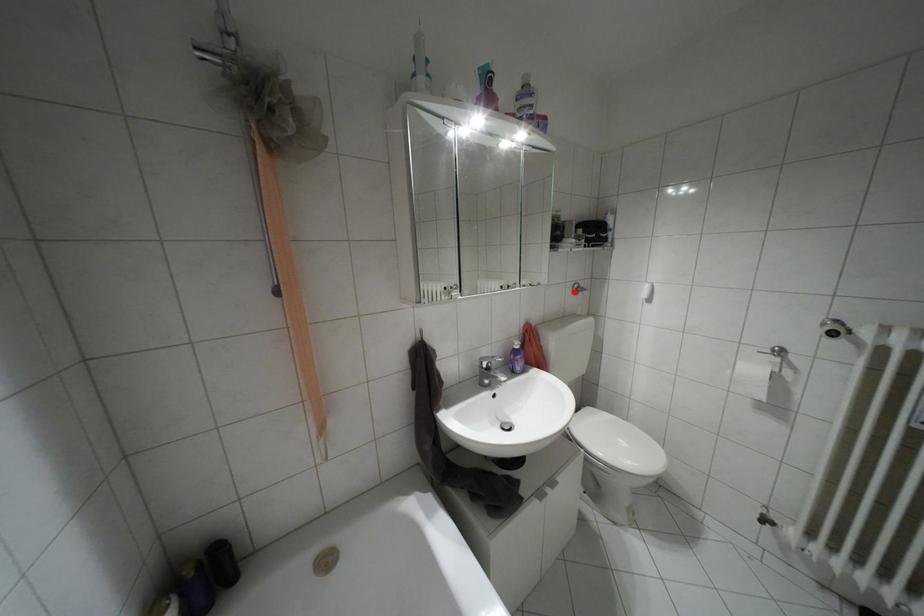
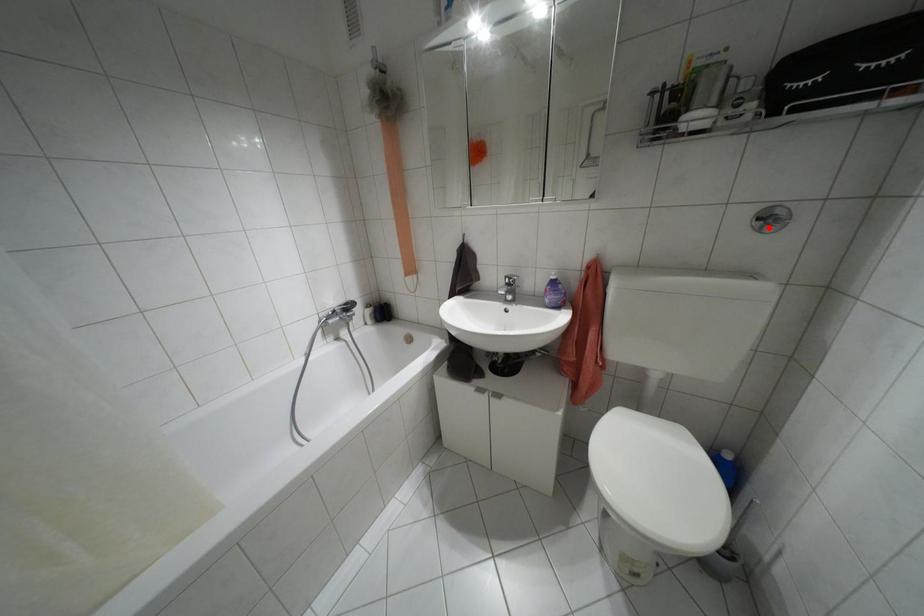
I am providing you with two images of the same scene from different viewpoints. A red point is marked on the first image and another point is marked on the second image. Do the highlighted points in image1 and image2 indicate the same real-world spot?

Yes